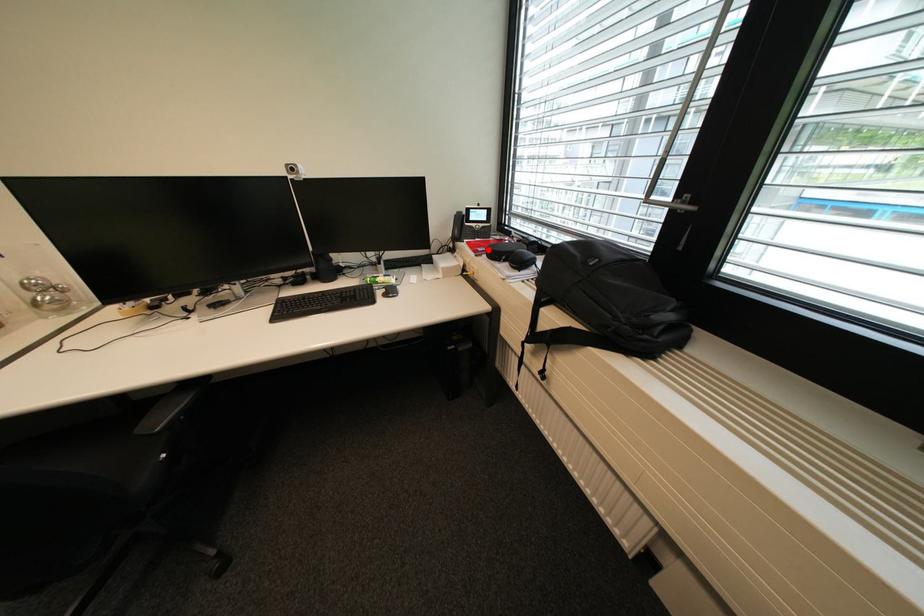
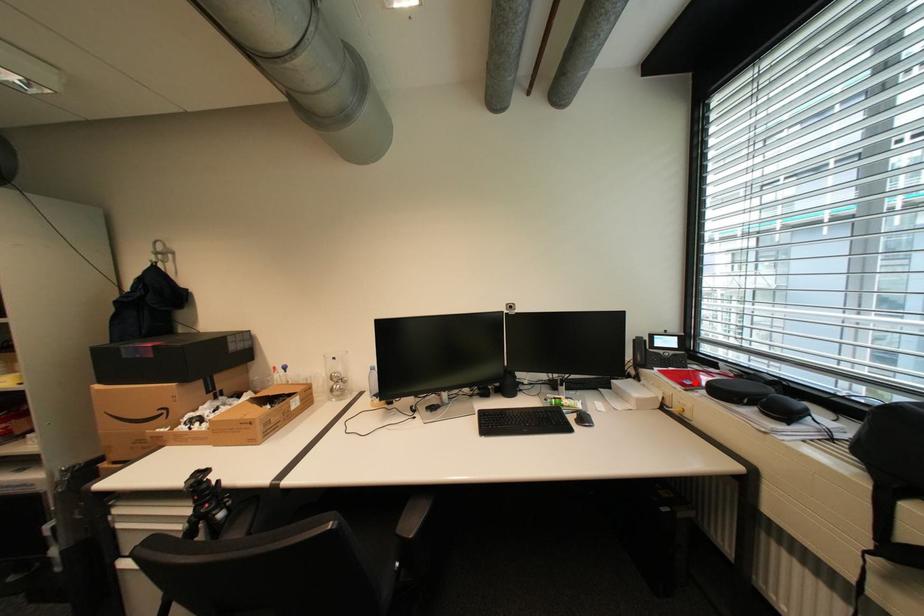
I am providing you with two images of the same scene from different viewpoints. A red point is marked on the first image and another point is marked on the second image. Is the marked point in image1 the same physical position as the marked point in image2?

Yes